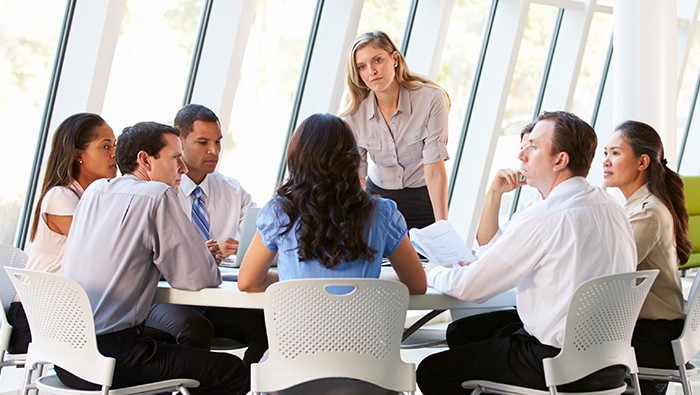
You are a GUI agent. You are given a task and a screenshot of the screen. Output one action in this format:
    pyautogui.click(x=<x>, y=<y>)
    Task: Click on the chairs
    The image size is (700, 395).
    Given the screenshot: What is the action you would take?
    pyautogui.click(x=66, y=330), pyautogui.click(x=349, y=336), pyautogui.click(x=612, y=314), pyautogui.click(x=691, y=333), pyautogui.click(x=13, y=284)